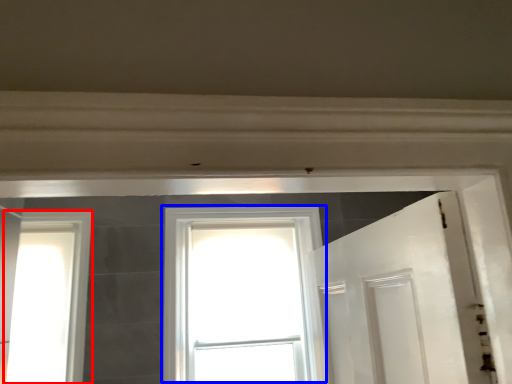
Question: Which of the following is the farthest to the observer, window (highlighted by a red box) or window (highlighted by a blue box)?

Choices:
 (A) window
 (B) window

Answer: (B)